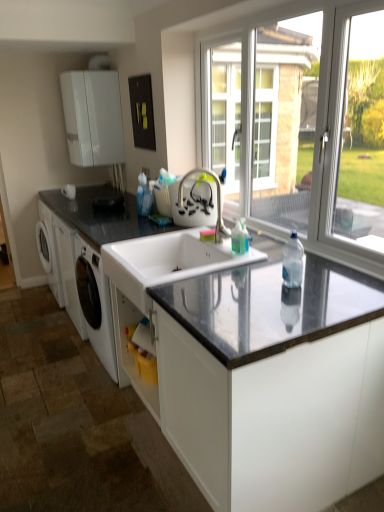
Question: Considering the relative sizes of white matte cabinet at upper left and satin nickel faucet at center in the image provided, is white matte cabinet at upper left taller than satin nickel faucet at center?

Choices:
 (A) no
 (B) yes

Answer: (B)

Question: From the image's perspective, is white matte cabinet at upper left beneath satin nickel faucet at center?

Choices:
 (A) no
 (B) yes

Answer: (A)

Question: Is white matte cabinet at upper left closer to the viewer compared to satin nickel faucet at center?

Choices:
 (A) yes
 (B) no

Answer: (B)

Question: Is white matte cabinet at upper left surrounding satin nickel faucet at center?

Choices:
 (A) no
 (B) yes

Answer: (A)

Question: Does white matte cabinet at upper left have a larger size compared to satin nickel faucet at center?

Choices:
 (A) no
 (B) yes

Answer: (B)

Question: Considering the positions of point (61, 199) and point (147, 311), is point (61, 199) closer or farther from the camera than point (147, 311)?

Choices:
 (A) farther
 (B) closer

Answer: (A)

Question: Based on their sizes in the image, would you say black granite countertop at left, which ranks as the 2th countertop in bottom-to-top order, is bigger or smaller than white ceramic sink at center?

Choices:
 (A) small
 (B) big

Answer: (B)

Question: From the image's perspective, is black granite countertop at left, which ranks as the 2th countertop in bottom-to-top order, above or below white ceramic sink at center?

Choices:
 (A) above
 (B) below

Answer: (A)

Question: Is black granite countertop at left, which ranks as the 2th countertop in bottom-to-top order, wider or thinner than white ceramic sink at center?

Choices:
 (A) wide
 (B) thin

Answer: (A)

Question: From a real-world perspective, is white ceramic sink at center positioned above or below white matte cabinet at upper left?

Choices:
 (A) below
 (B) above

Answer: (A)

Question: From the image's perspective, is white ceramic sink at center positioned above or below white matte cabinet at upper left?

Choices:
 (A) above
 (B) below

Answer: (B)

Question: Visually, is white ceramic sink at center positioned to the left or to the right of white matte cabinet at upper left?

Choices:
 (A) left
 (B) right

Answer: (B)

Question: Considering the positions of point (135, 240) and point (102, 86), is point (135, 240) closer or farther from the camera than point (102, 86)?

Choices:
 (A) closer
 (B) farther

Answer: (A)

Question: Looking at the image, does white matte cabinet at upper left seem bigger or smaller compared to clear plastic bottle at center?

Choices:
 (A) big
 (B) small

Answer: (A)

Question: From a real-world perspective, relative to clear plastic bottle at center, is white matte cabinet at upper left vertically above or below?

Choices:
 (A) above
 (B) below

Answer: (A)